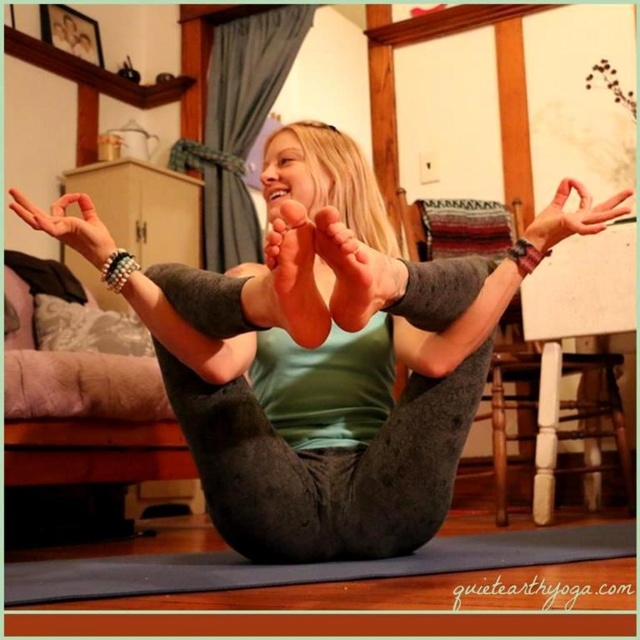
Question: Based on their relative distances, which object is farther from the gray fleece leggings at center?

Choices:
 (A) matte gray hand at upper center
 (B) matte gray foot at center

Answer: (A)

Question: Is matte gray foot at center smaller than matte gray hand at upper center?

Choices:
 (A) yes
 (B) no

Answer: (A)

Question: Which object appears farthest from the camera in this image?

Choices:
 (A) matte black bracelet at upper left
 (B) matte gray foot at center
 (C) matte gray hand at upper center
 (D) gray fleece leggings at center

Answer: (C)

Question: Is gray fleece leggings at center further to the viewer compared to matte black bracelet at upper left?

Choices:
 (A) yes
 (B) no

Answer: (B)

Question: Which point is farther from the camera taking this photo?

Choices:
 (A) (444, 276)
 (B) (340, 305)
 (C) (22, 196)

Answer: (C)

Question: Is gray fleece leggings at center wider than gray rubber yoga mat at lower center?

Choices:
 (A) yes
 (B) no

Answer: (B)